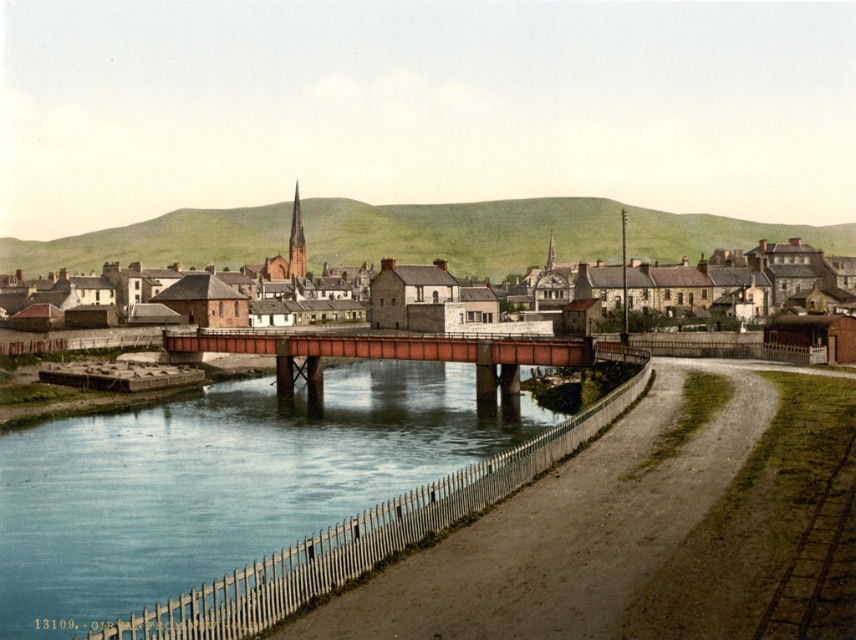
A hiker is standing at the point labeled point (193,228) and wants to reach the red bridge. The hiker has a drone that can fly 250 meters. Will the drone be able to reach the red bridge from the hiker?

The distance between point (193,228) and the red bridge is 263.70 meters. Since the drone can only fly 250 meters, it will not be able to reach the red bridge from the hiker.

You are standing on the dirt path next to the river and want to cross to the other side. The blue smooth water at center flows under the brown brick bridge at center. Which direction should you walk to find the bridge for crossing?

The brown brick bridge at center is located at the center of the image, so you should walk towards the center where the blue smooth water at center flows under the brown brick bridge at center to find the bridge for crossing.

You are standing at the point with coordinates point (102, 460) and want to walk to the point with coordinates point (485, 346). Based on the scene description, which direction should you face to walk towards your destination?

You should face north because point (102, 460) is in front of point (485, 346), indicating that the destination is behind you relative to your current position.